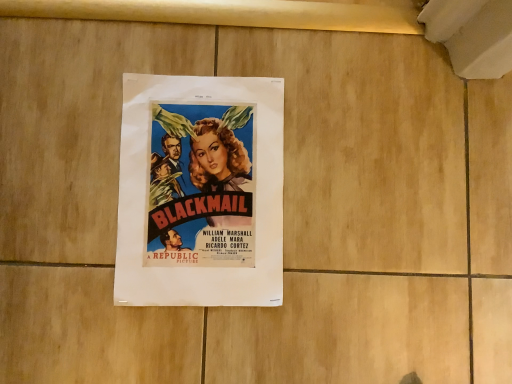
The width and height of the screenshot is (512, 384). Describe the element at coordinates (200, 192) in the screenshot. I see `matte paper poster at center` at that location.

The image size is (512, 384). I want to click on matte paper poster at center, so click(x=200, y=192).

Measure the distance between matte paper poster at center and camera.

The distance of matte paper poster at center from camera is 20.78 inches.

Identify the location of matte paper poster at center. The width and height of the screenshot is (512, 384). (200, 192).